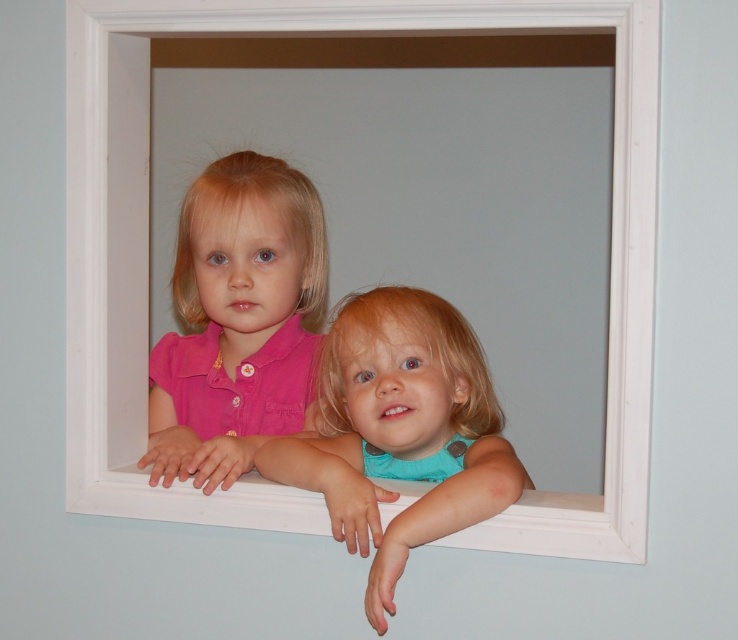
Who is higher up, white wooden window frame at center or turquoise matte shirt at center?

white wooden window frame at center

Measure the distance between white wooden window frame at center and turquoise matte shirt at center.

white wooden window frame at center and turquoise matte shirt at center are 6.07 inches apart from each other.

Locate an element on the screen. white wooden window frame at center is located at coordinates (148, 259).

Who is higher up, pink matte shirt at center or turquoise matte shirt at center?

Positioned higher is pink matte shirt at center.

Can you confirm if pink matte shirt at center is positioned to the right of turquoise matte shirt at center?

In fact, pink matte shirt at center is to the left of turquoise matte shirt at center.

Is point (230, 195) closer to viewer compared to point (421, 540)?

That is False.

Where is `pink matte shirt at center`? Image resolution: width=738 pixels, height=640 pixels. pink matte shirt at center is located at coordinates click(x=237, y=321).

Between point (127, 300) and point (249, 189), which one is positioned behind?

Positioned behind is point (249, 189).

Can you confirm if white wooden window frame at center is bigger than pink matte shirt at center?

Yes.

Who is more distant from viewer, (382, 8) or (325, 273)?

The point (325, 273) is behind.

Locate an element on the screen. white wooden window frame at center is located at coordinates (148, 259).